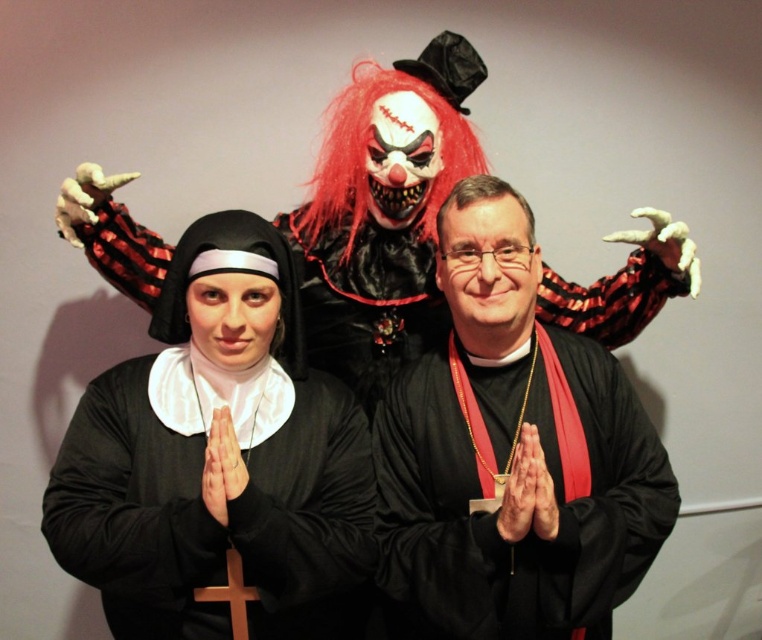
Is the position of black matte nun at center more distant than that of red synthetic wig at center?

No, black matte nun at center is closer to the viewer.

Which is behind, point (312, 516) or point (530, 227)?

The point (530, 227) is more distant.

This screenshot has width=762, height=640. I want to click on black matte nun at center, so click(218, 458).

Between point (594, 547) and point (495, 198), which one is positioned in front?

Point (594, 547) is more forward.

Between point (444, 220) and point (522, 196), which one is positioned behind?

Point (522, 196)

Measure the distance between point (x=594, y=611) and camera.

Point (x=594, y=611) and camera are 1.28 meters apart from each other.

I want to click on black matte priest at center, so click(511, 454).

Is point (221, 339) behind point (469, 346)?

No, it is not.

Which is in front, point (251, 289) or point (415, 417)?

Point (251, 289)

Identify the location of black matte nun at center. This screenshot has height=640, width=762. (218, 458).